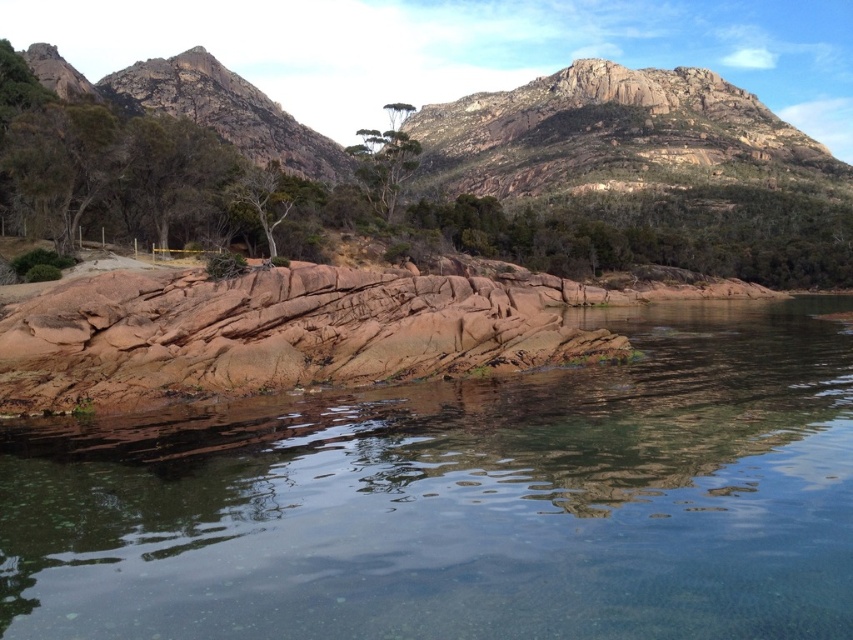
Question: Does rustic granite mountain at upper center appear on the right side of green textured tree at center?

Choices:
 (A) yes
 (B) no

Answer: (A)

Question: Can you confirm if rustic stone rock at center is positioned above green textured tree at center?

Choices:
 (A) yes
 (B) no

Answer: (B)

Question: Among these objects, which one is farthest from the camera?

Choices:
 (A) rustic stone rock at center
 (B) rustic granite mountain at upper center
 (C) green textured tree at center

Answer: (C)

Question: Can you confirm if green textured tree at center is wider than green matte tree at center?

Choices:
 (A) no
 (B) yes

Answer: (A)

Question: Which point is farther from the camera taking this photo?

Choices:
 (A) (416, 564)
 (B) (289, 179)
 (C) (183, 273)
 (D) (498, 257)

Answer: (D)

Question: Among these points, which one is nearest to the camera?

Choices:
 (A) (373, 170)
 (B) (236, 182)
 (C) (381, 353)
 (D) (94, 481)

Answer: (D)